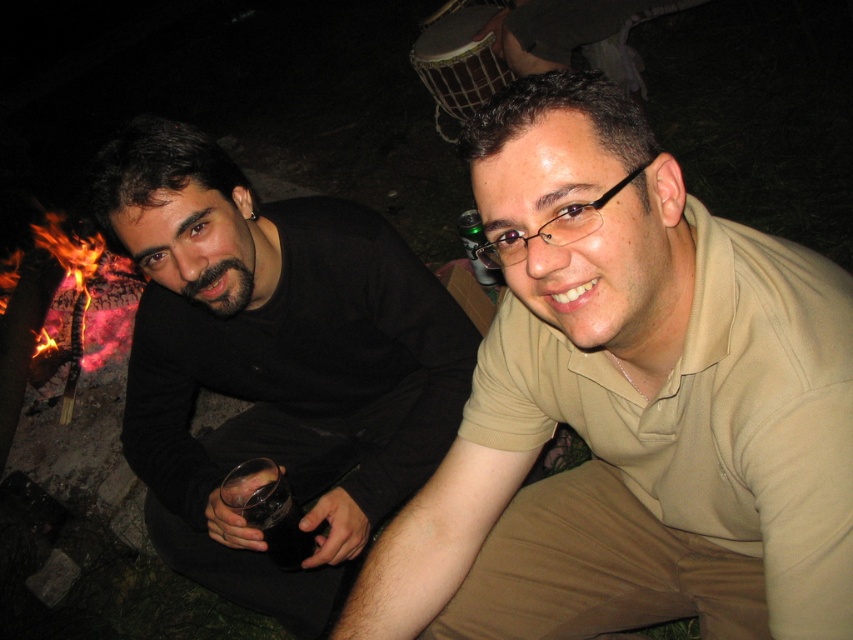
Can you confirm if beige cotton shirt at center is smaller than dark glass at lower left?

Incorrect, beige cotton shirt at center is not smaller in size than dark glass at lower left.

Can you confirm if beige cotton shirt at center is taller than dark glass at lower left?

Yes, beige cotton shirt at center is taller than dark glass at lower left.

Who is more distant from viewer, (457, 465) or (282, 524)?

Positioned behind is point (282, 524).

Identify the location of beige cotton shirt at center. This screenshot has height=640, width=853. (630, 404).

Does beige cotton shirt at center have a greater height compared to black matte shirt at left?

Incorrect, beige cotton shirt at center's height is not larger of black matte shirt at left's.

Who is lower down, beige cotton shirt at center or black matte shirt at left?

black matte shirt at left

Is point (613, 163) positioned before point (230, 584)?

That is True.

I want to click on beige cotton shirt at center, so click(630, 404).

Which is below, black matte shirt at left or dark glass at lower left?

Positioned lower is dark glass at lower left.

Does point (321, 333) lie behind point (277, 502)?

Yes.

Which is behind, point (286, 221) or point (289, 557)?

The point (286, 221) is behind.

This screenshot has height=640, width=853. I want to click on black matte shirt at left, so click(274, 364).